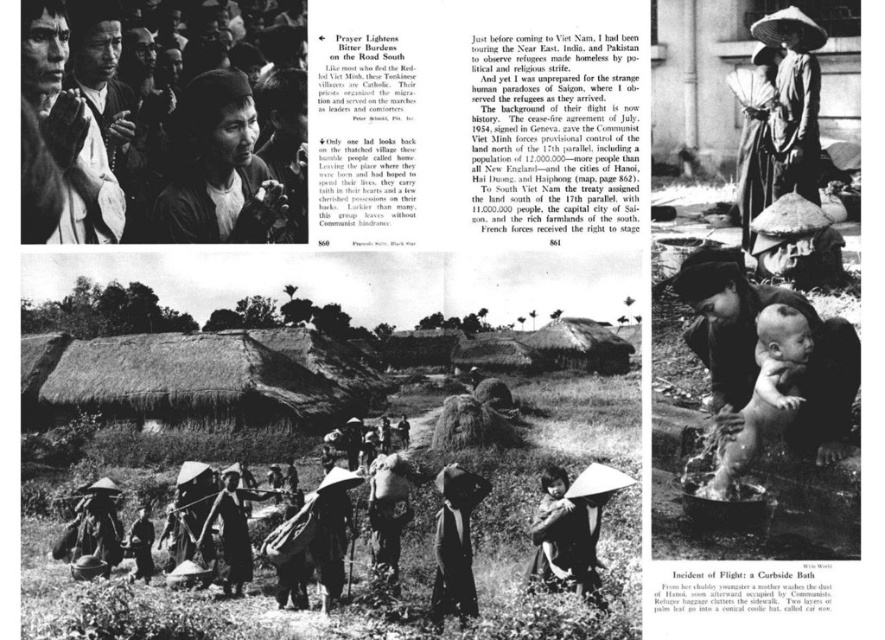
Question: Can you confirm if dark skin baby at lower right is positioned to the right of matte white hat at center?

Choices:
 (A) no
 (B) yes

Answer: (B)

Question: Which of the following is the farthest from the observer?

Choices:
 (A) (773, 308)
 (B) (573, 548)

Answer: (B)

Question: Does dark skin baby at lower right have a larger size compared to matte white hat at center?

Choices:
 (A) yes
 (B) no

Answer: (B)

Question: Which of the following is the closest to the observer?

Choices:
 (A) (714, 490)
 (B) (558, 499)

Answer: (A)

Question: Does dark skin baby at lower right appear over matte white hat at center?

Choices:
 (A) yes
 (B) no

Answer: (A)

Question: Which of the following is the farthest from the observer?

Choices:
 (A) (776, 376)
 (B) (597, 528)

Answer: (B)